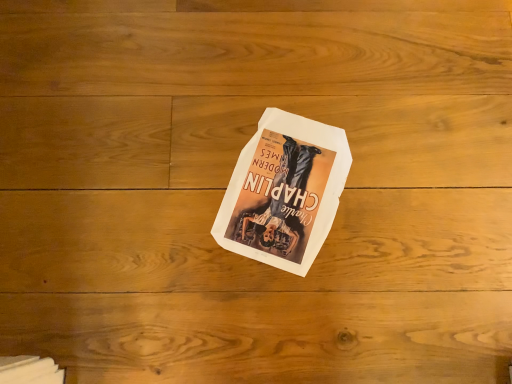
The width and height of the screenshot is (512, 384). In order to click on empty space that is to the right of white paper at center in this screenshot , I will do `click(403, 188)`.